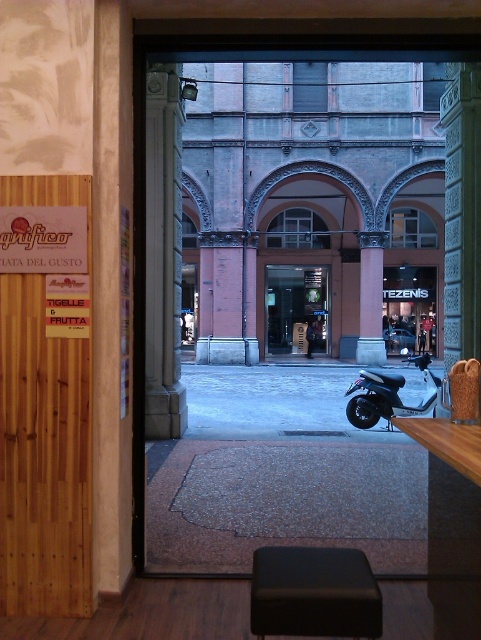
In the scene shown: You are a delivery person entering the courtyard through the doorway. You need to locate the shiny black scooter at lower right. Which direction should you look relative to the wooden sign at left?

The wooden sign at left is located above the shiny black scooter at lower right, so you should look downward from the wooden sign at left to find the shiny black scooter at lower right.

You are standing in the interior space and want to exit through the doorway. Which direction should you walk to avoid the wooden sign at left?

To exit through the doorway while avoiding the wooden sign at left, you should walk towards the right side of the interior space since the wooden sign at left is located on the left side.